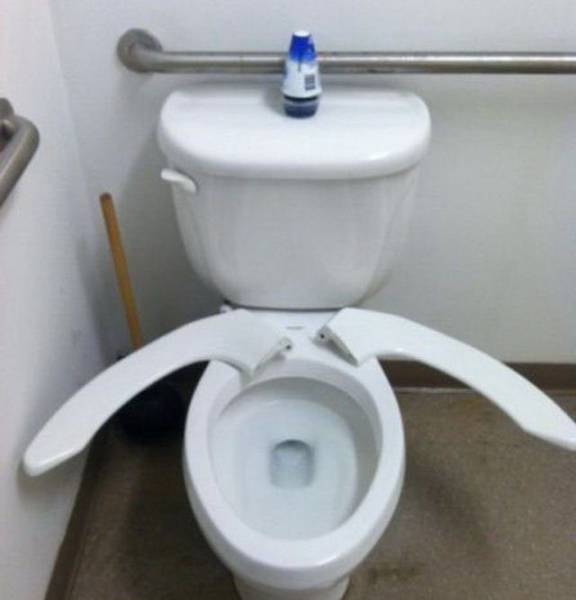
Where is `toilet seat halves`? This screenshot has height=600, width=576. toilet seat halves is located at coordinates (238, 340), (388, 331).